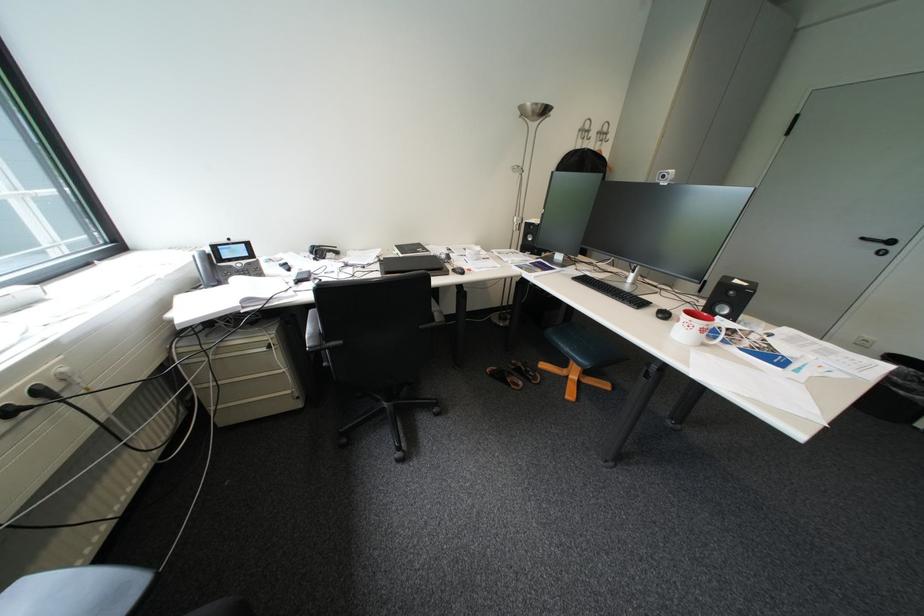
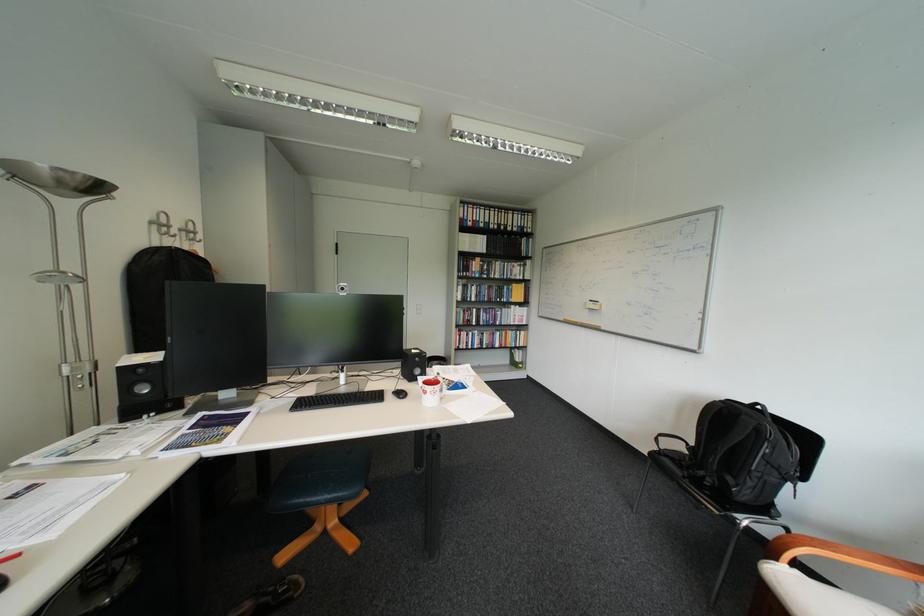
The point at (597, 132) is marked in the first image. Where is the corresponding point in the second image?

(173, 225)